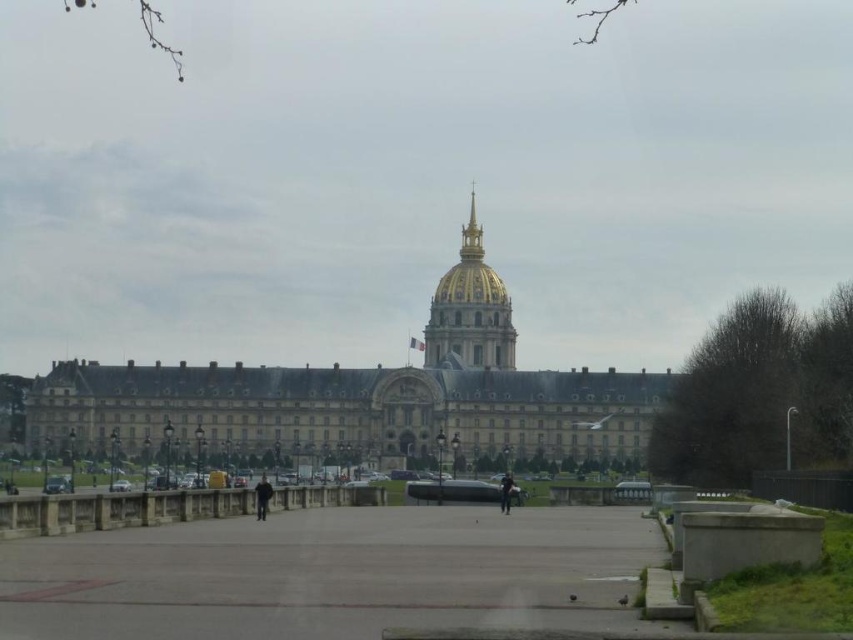
Question: Which of the following is the closest to the observer?

Choices:
 (A) (260, 512)
 (B) (508, 483)
 (C) (474, 419)

Answer: (A)

Question: Can you confirm if dark gray stone building at center is positioned above black fabric person at center?

Choices:
 (A) yes
 (B) no

Answer: (A)

Question: Which of the following is the closest to the observer?

Choices:
 (A) dark gray stone building at center
 (B) black fabric person at center
 (C) black matte jacket at center

Answer: (C)

Question: Is dark gray stone building at center bigger than black matte jacket at center?

Choices:
 (A) yes
 (B) no

Answer: (A)

Question: Which object appears farthest from the camera in this image?

Choices:
 (A) black fabric person at center
 (B) dark gray stone building at center

Answer: (B)

Question: Is dark gray stone building at center bigger than black matte jacket at center?

Choices:
 (A) yes
 (B) no

Answer: (A)